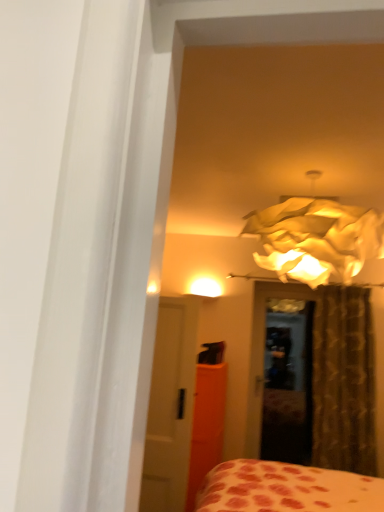
Question: Does matte paper lampshade at upper center come in front of brown textured curtain at right?

Choices:
 (A) no
 (B) yes

Answer: (B)

Question: Considering the relative sizes of matte paper lampshade at upper center and brown textured curtain at right in the image provided, is matte paper lampshade at upper center smaller than brown textured curtain at right?

Choices:
 (A) yes
 (B) no

Answer: (B)

Question: Considering the relative positions of matte paper lampshade at upper center and brown textured curtain at right in the image provided, is matte paper lampshade at upper center to the left of brown textured curtain at right from the viewer's perspective?

Choices:
 (A) no
 (B) yes

Answer: (B)

Question: Could you tell me if matte paper lampshade at upper center is turned towards brown textured curtain at right?

Choices:
 (A) yes
 (B) no

Answer: (B)

Question: Is matte paper lampshade at upper center further to the viewer compared to brown textured curtain at right?

Choices:
 (A) no
 (B) yes

Answer: (A)

Question: Is brown textured curtain at right in front of or behind orange matte armoire at center in the image?

Choices:
 (A) behind
 (B) front

Answer: (A)

Question: From the image's perspective, is brown textured curtain at right above or below orange matte armoire at center?

Choices:
 (A) above
 (B) below

Answer: (A)

Question: Looking at their shapes, would you say brown textured curtain at right is wider or thinner than orange matte armoire at center?

Choices:
 (A) wide
 (B) thin

Answer: (B)

Question: From a real-world perspective, relative to orange matte armoire at center, is brown textured curtain at right vertically above or below?

Choices:
 (A) above
 (B) below

Answer: (A)

Question: Considering the positions of orange matte armoire at center and white glossy door at center in the image, is orange matte armoire at center wider or thinner than white glossy door at center?

Choices:
 (A) thin
 (B) wide

Answer: (B)

Question: Would you say orange matte armoire at center is to the left or to the right of white glossy door at center in the picture?

Choices:
 (A) right
 (B) left

Answer: (A)

Question: From the image's perspective, relative to white glossy door at center, is orange matte armoire at center above or below?

Choices:
 (A) below
 (B) above

Answer: (A)

Question: Based on their sizes in the image, would you say orange matte armoire at center is bigger or smaller than white glossy door at center?

Choices:
 (A) big
 (B) small

Answer: (A)

Question: In terms of size, does matte paper lampshade at upper center appear bigger or smaller than orange matte armoire at center?

Choices:
 (A) small
 (B) big

Answer: (B)

Question: From the image's perspective, is matte paper lampshade at upper center located above or below orange matte armoire at center?

Choices:
 (A) below
 (B) above

Answer: (B)